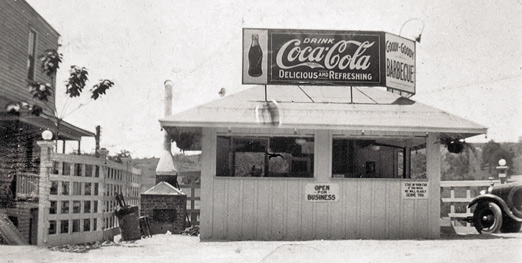
This screenshot has width=522, height=263. I want to click on window area, so click(264, 157), click(379, 155).